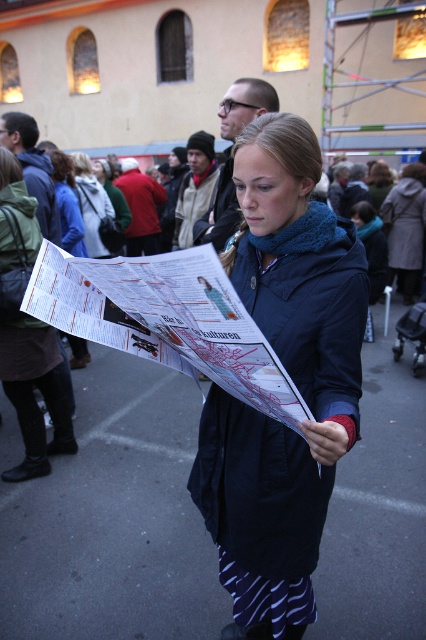
Where is `blue matte coat at center`? Image resolution: width=426 pixels, height=640 pixels. blue matte coat at center is located at coordinates (290, 378).

Is point (256, 573) closer to viewer compared to point (183, 310)?

No, (256, 573) is further to viewer.

This screenshot has width=426, height=640. I want to click on blue matte coat at center, so click(x=290, y=378).

Can you confirm if white printed map at center is smaller than matte paper map at center?

Actually, white printed map at center might be larger than matte paper map at center.

Does white printed map at center appear on the left side of matte paper map at center?

Incorrect, white printed map at center is not on the left side of matte paper map at center.

Locate an element on the screen. This screenshot has width=426, height=640. white printed map at center is located at coordinates (166, 320).

Can you confirm if blue matte coat at center is positioned above matte paper map at center?

No, blue matte coat at center is not above matte paper map at center.

From the picture: Can you confirm if blue matte coat at center is positioned below matte paper map at center?

Yes.

At what (x,y) coordinates should I click in order to perform the action: click on blue matte coat at center. Please return your answer as a coordinate pair (x, y). The height and width of the screenshot is (640, 426). Looking at the image, I should click on (290, 378).